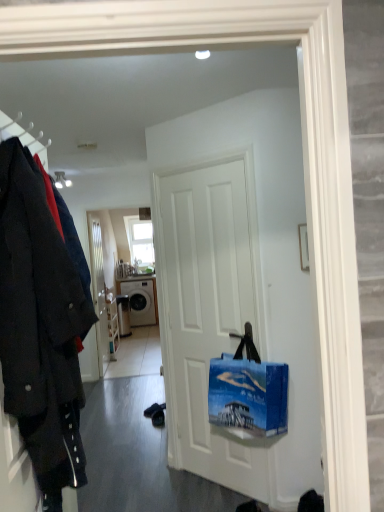
Where is `white glossy washing machine at center`? This screenshot has width=384, height=512. white glossy washing machine at center is located at coordinates (140, 301).

The width and height of the screenshot is (384, 512). What do you see at coordinates (140, 242) in the screenshot? I see `clear glass window at upper center` at bounding box center [140, 242].

Describe the element at coordinates (248, 391) in the screenshot. The height and width of the screenshot is (512, 384). I see `blue canvas bag at center` at that location.

The image size is (384, 512). What do you see at coordinates (208, 312) in the screenshot?
I see `white matte door at center, acting as the 1th door starting from the front` at bounding box center [208, 312].

This screenshot has width=384, height=512. Describe the element at coordinates (62, 180) in the screenshot. I see `matte white ceiling light at upper center` at that location.

At what (x,y) coordinates should I click in order to perform the action: click on white glossy door at center, which is the 2th door from front to back. Please return your answer as a coordinate pair (x, y). The height and width of the screenshot is (512, 384). Looking at the image, I should click on (99, 288).

The image size is (384, 512). Find the location of `white glossy washing machine at center`. white glossy washing machine at center is located at coordinates (140, 301).

Is point (16, 199) more distant than point (135, 255)?

No, it is not.

Based on the photo, measure the distance from dark wool coat at left to clear glass window at upper center.

dark wool coat at left is 19.11 feet from clear glass window at upper center.

From the image's perspective, which one is positioned lower, dark wool coat at left or clear glass window at upper center?

From the image's view, dark wool coat at left is below.

Is dark wool coat at left beside clear glass window at upper center?

No, dark wool coat at left is not touching clear glass window at upper center.

In terms of height, does white glossy washing machine at center look taller or shorter compared to dark wool coat at left?

In the image, white glossy washing machine at center appears to be shorter than dark wool coat at left.

Between white glossy washing machine at center and dark wool coat at left, which one appears on the left side from the viewer's perspective?

white glossy washing machine at center.

Is white glossy washing machine at center facing away from dark wool coat at left?

No, white glossy washing machine at center is not facing away from dark wool coat at left.

Does point (135, 292) come closer to viewer compared to point (32, 194)?

No, (135, 292) is further to viewer.

Is dark wool coat at left in front of or behind white glossy washing machine at center in the image?

In the image, dark wool coat at left appears in front of white glossy washing machine at center.

Can you confirm if dark wool coat at left is taller than white glossy washing machine at center?

Correct, dark wool coat at left is much taller as white glossy washing machine at center.

Considering the sizes of objects dark wool coat at left and white glossy washing machine at center in the image provided, who is wider, dark wool coat at left or white glossy washing machine at center?

With larger width is white glossy washing machine at center.

Is clear glass window at upper center with white glossy door at center, which ranks as the first door in back-to-front order?

No, clear glass window at upper center is not in contact with white glossy door at center, which ranks as the first door in back-to-front order.

Can you confirm if clear glass window at upper center is taller than white glossy door at center, the first door from the left?

No, clear glass window at upper center is not taller than white glossy door at center, the first door from the left.

Is point (131, 246) closer or farther from the camera than point (103, 293)?

Clearly, point (131, 246) is more distant from the camera than point (103, 293).

Does matte white ceiling light at upper center have a greater width compared to dark wool coat at left?

No.

Is matte white ceiling light at upper center smaller than dark wool coat at left?

Yes.

Considering the relative sizes of matte white ceiling light at upper center and dark wool coat at left in the image provided, is matte white ceiling light at upper center taller than dark wool coat at left?

In fact, matte white ceiling light at upper center may be shorter than dark wool coat at left.

From a real-world perspective, is clear glass window at upper center positioned under blue canvas bag at center based on gravity?

No, from a real-world perspective, clear glass window at upper center is not below blue canvas bag at center.

Is clear glass window at upper center touching blue canvas bag at center?

clear glass window at upper center and blue canvas bag at center are clearly separated.

Can you confirm if clear glass window at upper center is shorter than blue canvas bag at center?

No.

Does clear glass window at upper center turn towards blue canvas bag at center?

Yes, clear glass window at upper center faces towards blue canvas bag at center.

Considering the sizes of objects blue canvas bag at center and dark wool coat at left in the image provided, who is shorter, blue canvas bag at center or dark wool coat at left?

blue canvas bag at center.

From a real-world perspective, is blue canvas bag at center above or below dark wool coat at left?

In terms of real-world spatial position, blue canvas bag at center is below dark wool coat at left.

Is blue canvas bag at center thinner than dark wool coat at left?

No, blue canvas bag at center is not thinner than dark wool coat at left.

Where is `window located behind the dark wool coat at left`? Image resolution: width=384 pixels, height=512 pixels. window located behind the dark wool coat at left is located at coordinates (140, 242).

Where is `coat located above the white glossy washing machine at center (from the image's perspective)`? coat located above the white glossy washing machine at center (from the image's perspective) is located at coordinates (40, 325).

When comparing their distances from white glossy washing machine at center, does dark wool coat at left or white glossy door at center, which ranks as the first door in back-to-front order, seem closer?

white glossy door at center, which ranks as the first door in back-to-front order, is closer to white glossy washing machine at center.

Looking at the image, which one is located further to white glossy door at center, which ranks as the first door in back-to-front order, white matte door at center, the first door positioned from the right, or matte white ceiling light at upper center?

white matte door at center, the first door positioned from the right, is positioned further to the anchor white glossy door at center, which ranks as the first door in back-to-front order.

Considering their positions, is white glossy door at center, which ranks as the first door in back-to-front order, positioned further to white matte door at center, placed as the second door when sorted from back to front, than blue canvas bag at center?

white glossy door at center, which ranks as the first door in back-to-front order, is further to white matte door at center, placed as the second door when sorted from back to front.

Looking at this image, which object lies further to the anchor point white glossy washing machine at center, matte white ceiling light at upper center or blue canvas bag at center?

Based on the image, blue canvas bag at center appears to be further to white glossy washing machine at center.

Which object lies further to the anchor point blue canvas bag at center, matte white ceiling light at upper center or white glossy washing machine at center?

The object further to blue canvas bag at center is white glossy washing machine at center.

Looking at the image, which one is located closer to white matte door at center, the second door when ordered from left to right, blue canvas bag at center or dark wool coat at left?

The object closer to white matte door at center, the second door when ordered from left to right, is blue canvas bag at center.

Consider the image. Estimate the real-world distances between objects in this image. Which object is further from dark wool coat at left, white glossy washing machine at center or white matte door at center, placed as the second door when sorted from back to front?

white glossy washing machine at center lies further to dark wool coat at left than the other object.

Which object lies further to the anchor point white glossy door at center, the first door from the left, clear glass window at upper center or matte white ceiling light at upper center?

Based on the image, clear glass window at upper center appears to be further to white glossy door at center, the first door from the left.

Identify the location of door between matte white ceiling light at upper center and clear glass window at upper center along the z-axis. Image resolution: width=384 pixels, height=512 pixels. (99, 288).

What are the coordinates of `washing machine between matte white ceiling light at upper center and clear glass window at upper center from front to back` in the screenshot? It's located at (140, 301).

Image resolution: width=384 pixels, height=512 pixels. In order to click on door between dark wool coat at left and matte white ceiling light at upper center from front to back in this screenshot , I will do `click(208, 312)`.

Identify the location of handbag positioned between dark wool coat at left and white glossy washing machine at center from near to far. This screenshot has height=512, width=384. (248, 391).